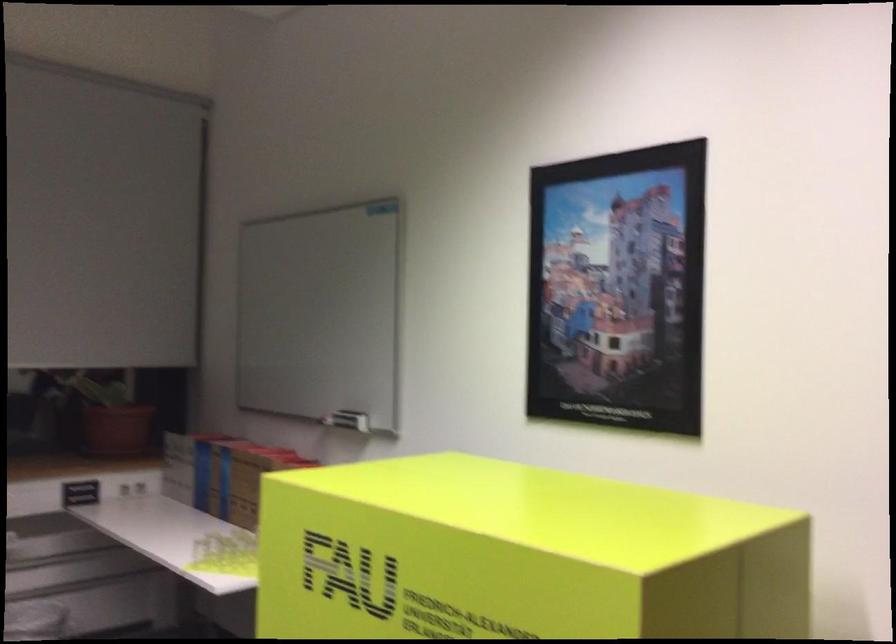
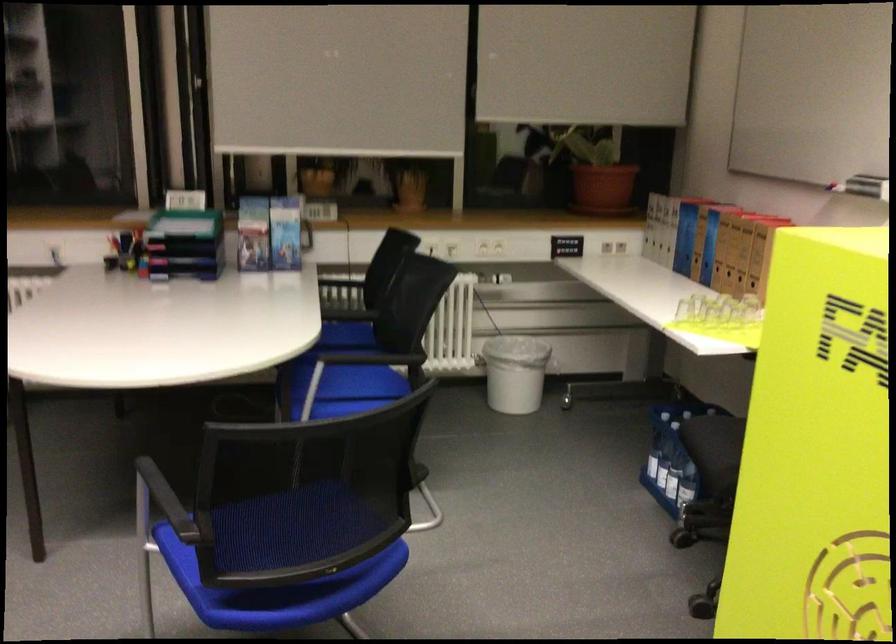
How did the camera likely rotate?

The camera's rotation is toward left-down.